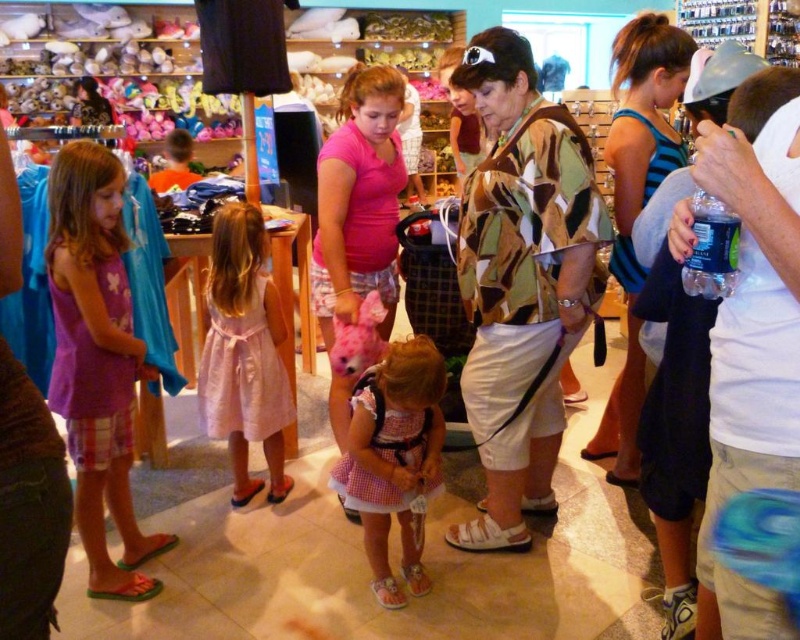
Question: Is camouflage fabric shirt at center to the left of blue striped tank top at right from the viewer's perspective?

Choices:
 (A) no
 (B) yes

Answer: (B)

Question: Can you confirm if pink matte shirt at center is wider than pink satin dress at center?

Choices:
 (A) yes
 (B) no

Answer: (A)

Question: Which of the following is the closest to the observer?

Choices:
 (A) pink gingham dress at center
 (B) pink matte shirt at center

Answer: (A)

Question: Which object is farther from the camera taking this photo?

Choices:
 (A) camouflage fabric shirt at center
 (B) pink matte shirt at center

Answer: (B)

Question: Does camouflage fabric shirt at center appear over pink gingham dress at center?

Choices:
 (A) yes
 (B) no

Answer: (A)

Question: Which point is farther to the camera?

Choices:
 (A) camouflage fabric shirt at center
 (B) pink gingham dress at center

Answer: (A)